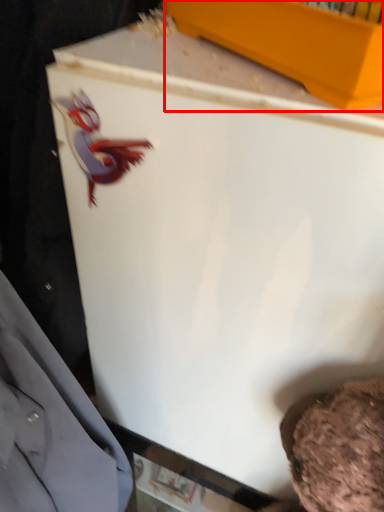
Question: Observing the image, what is the correct spatial positioning of box (annotated by the red box) in reference to dress shirt?

Choices:
 (A) right
 (B) left

Answer: (A)